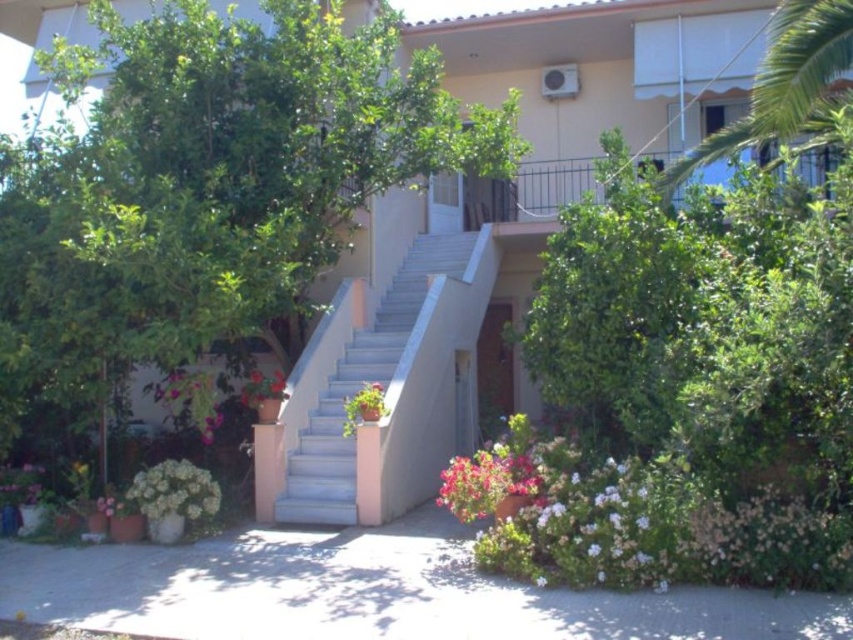
Who is taller, white concrete stairs at center or green leafy tree at upper right?

With more height is green leafy tree at upper right.

Based on the photo, does white concrete stairs at center lie in front of green leafy tree at upper right?

No.

The width and height of the screenshot is (853, 640). In order to click on white concrete stairs at center in this screenshot , I will do `click(363, 381)`.

Which is below, white concrete stairs at center or white matte flowers at lower left?

white matte flowers at lower left is below.

The height and width of the screenshot is (640, 853). What are the coordinates of `white concrete stairs at center` in the screenshot? It's located at (363, 381).

Is green leafy tree at upper right above white matte flowers at lower left?

Yes, green leafy tree at upper right is above white matte flowers at lower left.

Is the position of green leafy tree at upper right more distant than that of white matte flowers at lower left?

That is False.

Locate an element on the screen. The height and width of the screenshot is (640, 853). green leafy tree at upper right is located at coordinates coord(784,84).